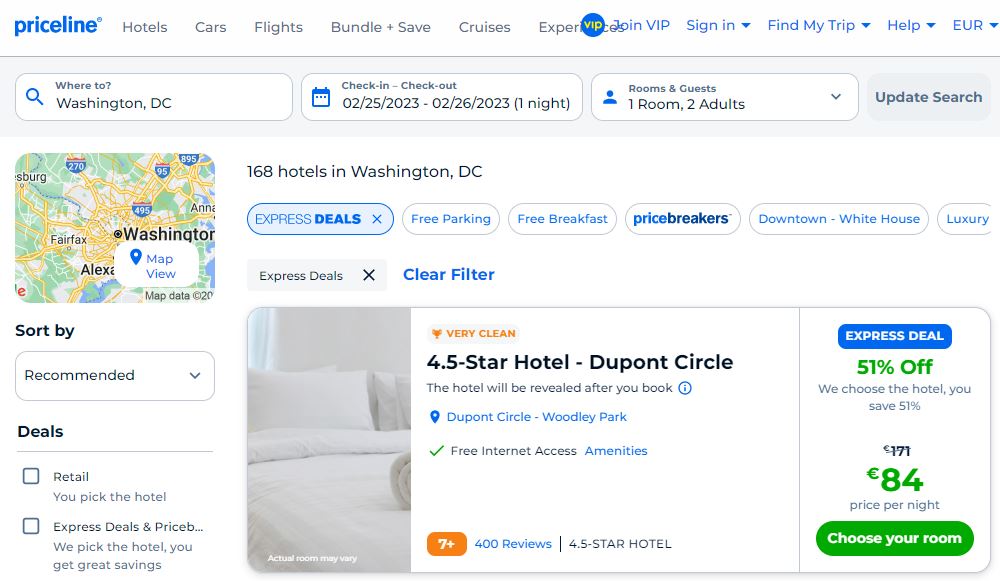
Where is `rolled up towel`? This screenshot has width=1000, height=581. rolled up towel is located at coordinates (402, 476).